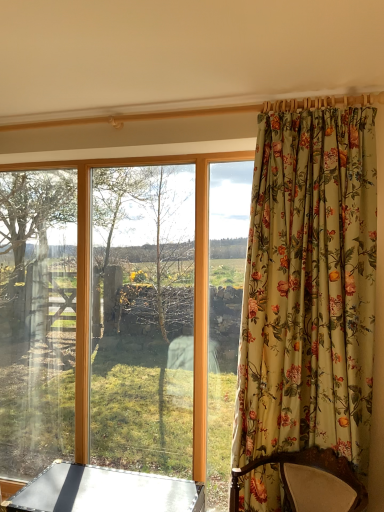
Question: From a real-world perspective, is transparent glass window at center positioned over metallic silver table at lower left based on gravity?

Choices:
 (A) no
 (B) yes

Answer: (B)

Question: Is transparent glass window at center thinner than metallic silver table at lower left?

Choices:
 (A) no
 (B) yes

Answer: (B)

Question: Is transparent glass window at center with metallic silver table at lower left?

Choices:
 (A) no
 (B) yes

Answer: (A)

Question: Considering the relative positions of transparent glass window at center and metallic silver table at lower left in the image provided, is transparent glass window at center to the left of metallic silver table at lower left from the viewer's perspective?

Choices:
 (A) yes
 (B) no

Answer: (A)

Question: Is transparent glass window at center not within metallic silver table at lower left?

Choices:
 (A) yes
 (B) no

Answer: (A)

Question: Is transparent glass window at center facing towards metallic silver table at lower left?

Choices:
 (A) no
 (B) yes

Answer: (B)

Question: Is metallic silver table at lower left completely or partially outside of floral fabric curtain at right?

Choices:
 (A) no
 (B) yes

Answer: (B)

Question: Can you confirm if metallic silver table at lower left is taller than floral fabric curtain at right?

Choices:
 (A) yes
 (B) no

Answer: (B)

Question: From the image's perspective, is metallic silver table at lower left above floral fabric curtain at right?

Choices:
 (A) no
 (B) yes

Answer: (A)

Question: Is metallic silver table at lower left thinner than floral fabric curtain at right?

Choices:
 (A) no
 (B) yes

Answer: (A)

Question: Can you confirm if metallic silver table at lower left is shorter than floral fabric curtain at right?

Choices:
 (A) no
 (B) yes

Answer: (B)

Question: Does metallic silver table at lower left have a greater width compared to floral fabric curtain at right?

Choices:
 (A) no
 (B) yes

Answer: (B)

Question: Is floral fabric curtain at right closer to the viewer compared to metallic silver table at lower left?

Choices:
 (A) no
 (B) yes

Answer: (B)